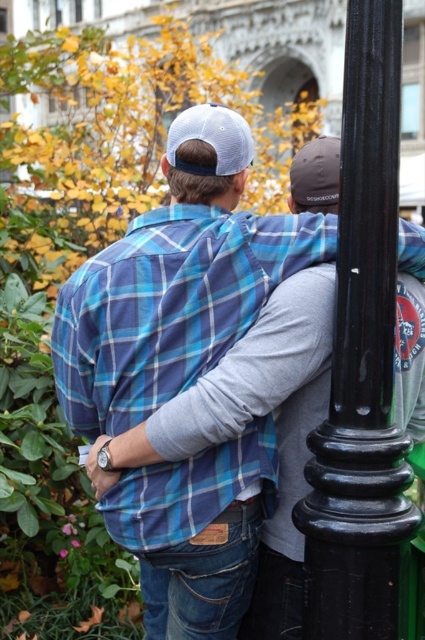
You are a photographer trying to capture both the blue plaid shirt at center and the black glossy pole at right in a single frame. Which object should you focus on first to ensure both are in the frame?

The blue plaid shirt at center is bigger than the black glossy pole at right, so you should focus on the black glossy pole at right first to ensure both fit in the frame.

You are a photographer trying to capture a clear shot of the blue plaid shirt at center and the black glossy pole at right. Since you want both subjects to be in focus, which one should you focus on first to ensure the other is also in focus?

The blue plaid shirt at center is closer to you than the black glossy pole at right. To ensure both are in focus, you should focus on the blue plaid shirt at center first.